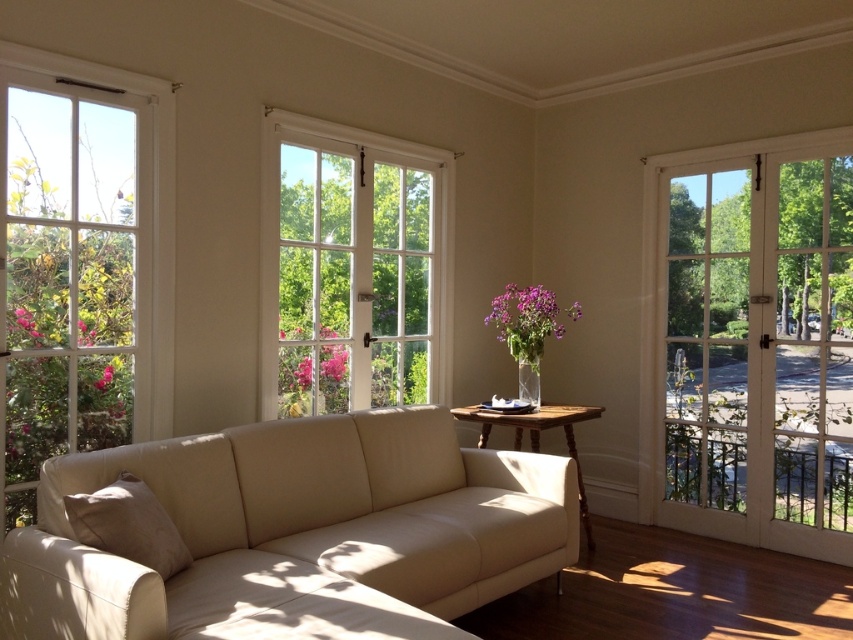
Question: Does beige leather couch at center appear under white wooden door at right?

Choices:
 (A) no
 (B) yes

Answer: (B)

Question: Which of the following is the closest to the observer?

Choices:
 (A) white wooden window at center
 (B) white wooden door at right
 (C) clear glass window at left

Answer: (C)

Question: Considering the real-world distances, which object is farthest from the clear glass window at left?

Choices:
 (A) beige leather couch at center
 (B) white wooden window at center
 (C) white wooden door at right

Answer: (C)

Question: Estimate the real-world distances between objects in this image. Which object is closer to the beige leather couch at center?

Choices:
 (A) clear glass window at left
 (B) white wooden door at right

Answer: (A)

Question: Considering the relative positions of beige leather couch at center and white wooden door at right in the image provided, where is beige leather couch at center located with respect to white wooden door at right?

Choices:
 (A) left
 (B) right

Answer: (A)

Question: Is white wooden door at right closer to camera compared to white wooden window at center?

Choices:
 (A) no
 (B) yes

Answer: (A)